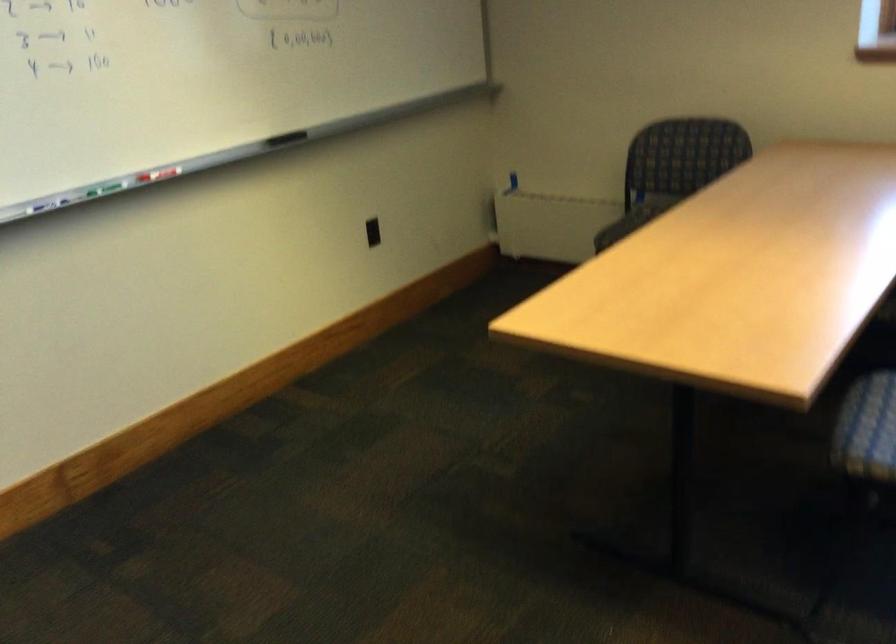
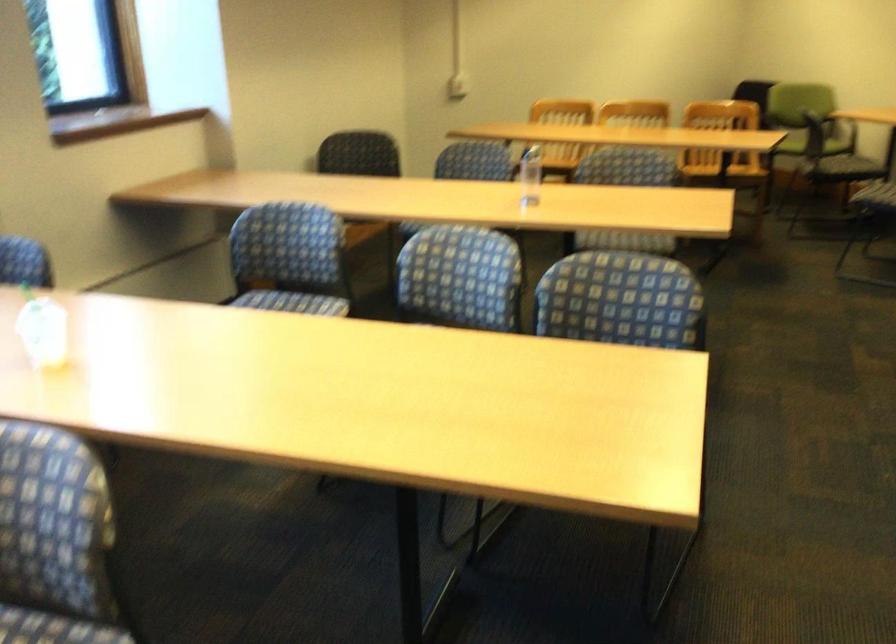
First-person continuous shooting, in which direction is the camera rotating?

The rotation direction of the camera is right-down.